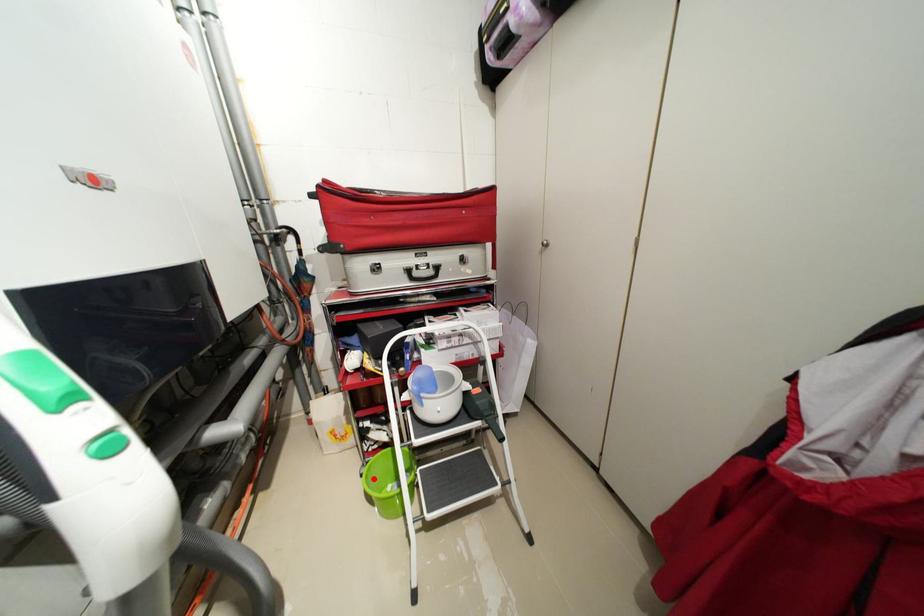
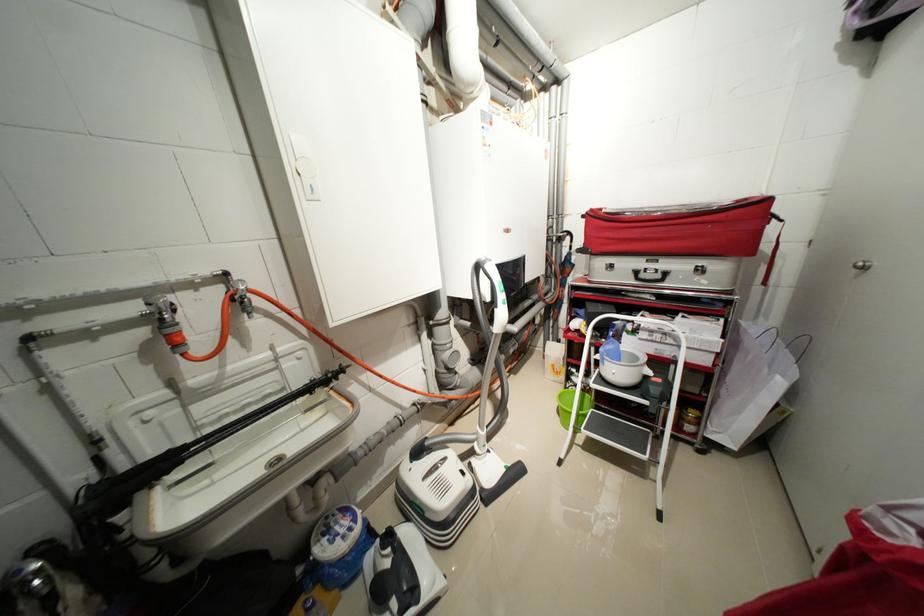
Where in the second image is the point corresponding to the highlighted location from the first image?

(566, 397)